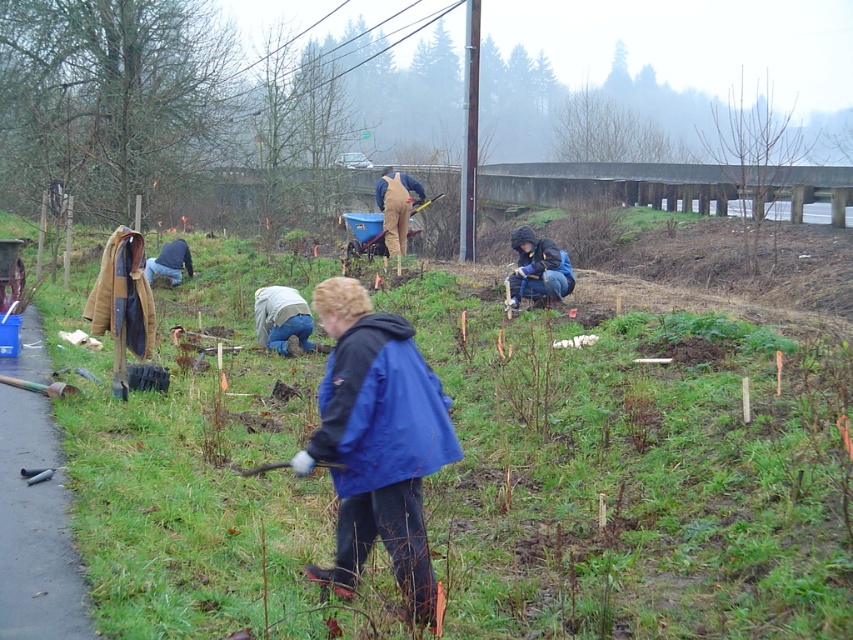
Question: Which of the following is the farthest from the observer?

Choices:
 (A) blue denim jeans at lower left
 (B) brown/canvas pants at center
 (C) blue fabric jacket at center

Answer: (A)

Question: Which of the following is the farthest from the observer?

Choices:
 (A) (251, 592)
 (B) (531, 244)
 (C) (357, 374)

Answer: (B)

Question: From the image, what is the correct spatial relationship of dark blue jacket at center in relation to blue denim jeans at lower left?

Choices:
 (A) left
 (B) right

Answer: (B)

Question: Does green grass at center appear on the left side of blue denim jeans at lower left?

Choices:
 (A) yes
 (B) no

Answer: (B)

Question: Does brown/canvas pants at center appear on the left side of blue denim jeans at lower left?

Choices:
 (A) no
 (B) yes

Answer: (A)

Question: Which is nearer to the blue fabric jacket at center?

Choices:
 (A) blue denim jeans at lower left
 (B) brown/canvas pants at center
 (C) dark blue jacket at center

Answer: (C)